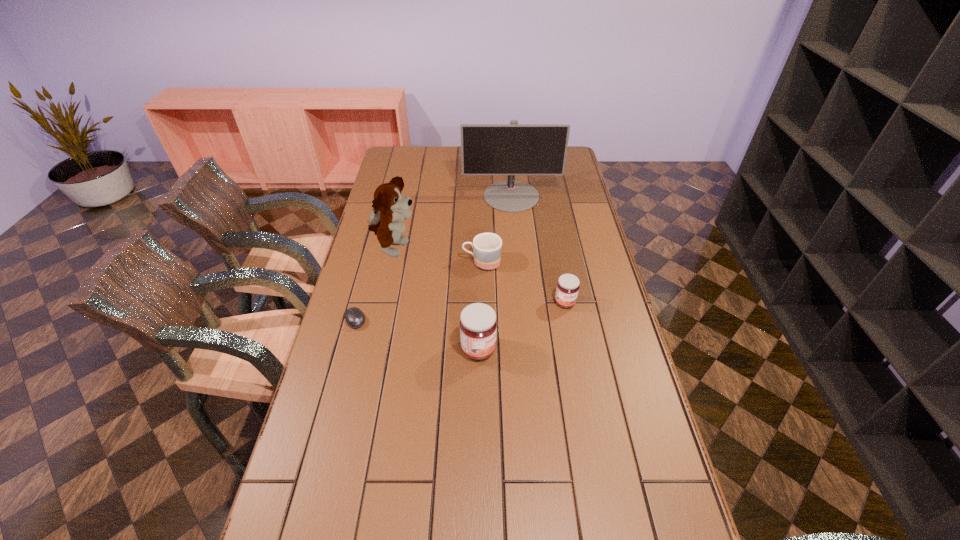
This screenshot has height=540, width=960. What are the coordinates of `free space at the near edge of the desktop` in the screenshot? It's located at (x=579, y=497).

Locate an element on the screen. vacant space at the left edge is located at coordinates (340, 477).

The image size is (960, 540). In order to click on free space at the right edge of the desktop in this screenshot , I will do `click(558, 177)`.

This screenshot has width=960, height=540. I want to click on free space at the far left corner of the desktop, so click(400, 146).

Identify the location of vacant space at the near right corner. The height and width of the screenshot is (540, 960). (621, 501).

In order to click on free spot between the farther jam and the puppy in this screenshot , I will do coord(479,276).

Identify the location of free space between the farthest object and the puppy. (453, 222).

Find the location of a particular element. The width and height of the screenshot is (960, 540). vacant point located between the farther jam and the puppy is located at coordinates (479, 276).

Where is `free space between the shortest object and the puppy`? This screenshot has height=540, width=960. free space between the shortest object and the puppy is located at coordinates (374, 284).

Find the location of a particular element. empty space that is in between the computer mouse and the puppy is located at coordinates (374, 284).